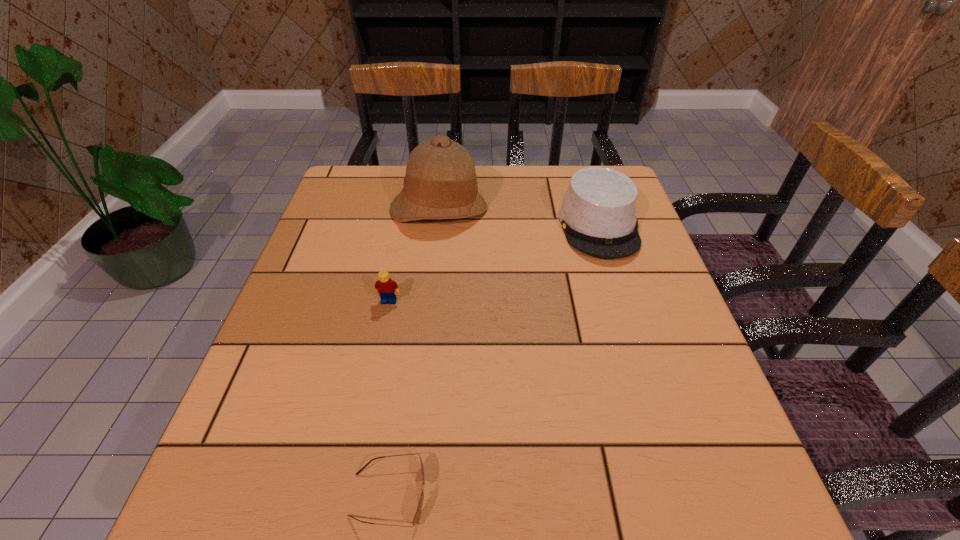
Find the location of a particular element. The width and height of the screenshot is (960, 540). the left hat is located at coordinates (440, 183).

I want to click on the tallest object, so click(x=440, y=183).

This screenshot has width=960, height=540. In order to click on the second tallest object in this screenshot , I will do `click(598, 213)`.

Find the location of `the shorter hat`. the shorter hat is located at coordinates (598, 213).

This screenshot has height=540, width=960. Identify the location of the second shortest object. (385, 286).

Identify the location of Lego. (385, 286).

Where is `the nearest object`? The width and height of the screenshot is (960, 540). the nearest object is located at coordinates (419, 508).

Locate an element on the screen. sunglasses is located at coordinates pyautogui.click(x=419, y=508).

The height and width of the screenshot is (540, 960). What are the coordinates of `free space located 0.090m on the front-facing side of the left hat` in the screenshot? It's located at (434, 255).

I want to click on vacant point located on the front-facing side of the right hat, so click(x=634, y=337).